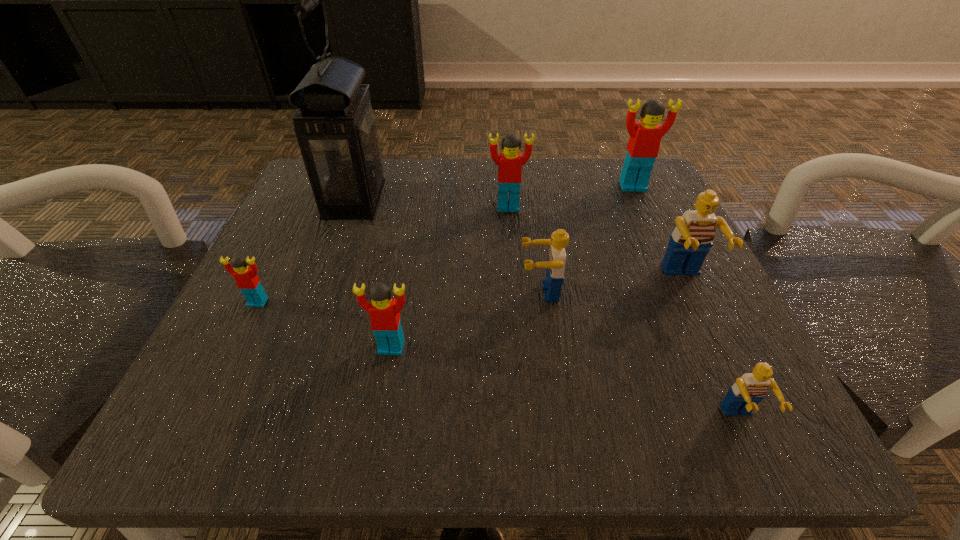
Identify the location of vacant space at the far edge of the desktop. (425, 172).

What are the coordinates of `vacant space at the near edge of the desktop` in the screenshot? It's located at (599, 427).

In the image, there is a desktop. In order to click on vacant space at the left edge in this screenshot , I will do `click(271, 334)`.

You are a GUI agent. You are given a task and a screenshot of the screen. Output one action in this format:
    pyautogui.click(x=<x>, y=<y>)
    Task: Click on the vacant space at the right edge
    The width and height of the screenshot is (960, 540).
    Given the screenshot: What is the action you would take?
    pyautogui.click(x=637, y=231)

Image resolution: width=960 pixels, height=540 pixels. I want to click on blank space at the near left corner of the desktop, so click(x=283, y=386).

Where is `vacant space at the far right corner of the desktop`? The width and height of the screenshot is (960, 540). vacant space at the far right corner of the desktop is located at coordinates (621, 213).

This screenshot has height=540, width=960. What are the coordinates of `empty space between the biggest blue Lego and the seventh object from right to left` in the screenshot? It's located at (519, 239).

Where is `unoccupied area between the third red Lego from left to right and the biggest red Lego`? unoccupied area between the third red Lego from left to right and the biggest red Lego is located at coordinates (570, 197).

The height and width of the screenshot is (540, 960). I want to click on free spot between the lantern and the biggest blue Lego, so click(x=519, y=239).

Where is `vacant space that is in between the farthest Lego and the seventh object from right to left`? The image size is (960, 540). vacant space that is in between the farthest Lego and the seventh object from right to left is located at coordinates (493, 193).